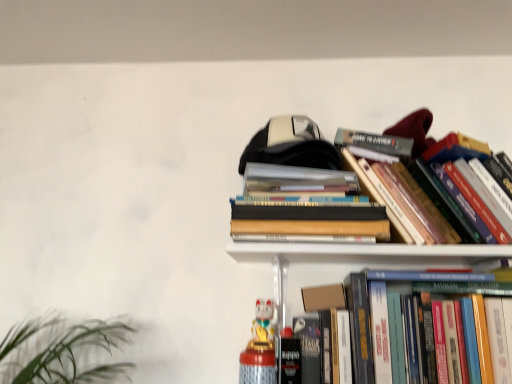
The image size is (512, 384). What do you see at coordinates (323, 297) in the screenshot? I see `cardboard box at upper center` at bounding box center [323, 297].

In order to face hardcover books at upper center, which is counted as the 2th book, starting from the top, should I rotate leftwards or rightwards?

Turn right by 7.086 degrees to look at hardcover books at upper center, which is counted as the 2th book, starting from the top.

Where is `cardboard box at upper center`? The width and height of the screenshot is (512, 384). cardboard box at upper center is located at coordinates (323, 297).

Between cardboard box at upper center and hardcover book at center right, positioned as the 1th book in bottom-to-top order, which one has smaller width?

cardboard box at upper center.

Does cardboard box at upper center touch hardcover book at center right, the third book in the top-to-bottom sequence?

No.

From the image's perspective, would you say cardboard box at upper center is positioned over hardcover book at center right, positioned as the 1th book in bottom-to-top order?

Yes, from the image's perspective, cardboard box at upper center is on top of hardcover book at center right, positioned as the 1th book in bottom-to-top order.

Does cardboard box at upper center have a lesser height compared to white glossy cat figurine at lower center?

Yes, cardboard box at upper center is shorter than white glossy cat figurine at lower center.

From the image's perspective, which is above, cardboard box at upper center or white glossy cat figurine at lower center?

From the image's view, cardboard box at upper center is above.

Is cardboard box at upper center facing towards white glossy cat figurine at lower center?

No, cardboard box at upper center is not aimed at white glossy cat figurine at lower center.

In terms of width, does cardboard box at upper center look wider or thinner when compared to white glossy cat figurine at lower center?

cardboard box at upper center is thinner than white glossy cat figurine at lower center.

Is hardcover book at center right, the third book in the top-to-bottom sequence, facing away from cardboard box at upper center?

Absolutely, hardcover book at center right, the third book in the top-to-bottom sequence, is directed away from cardboard box at upper center.

Looking at this image, from the image's perspective, which one is positioned lower, hardcover book at center right, the third book in the top-to-bottom sequence, or cardboard box at upper center?

hardcover book at center right, the third book in the top-to-bottom sequence, from the image's perspective.

From a real-world perspective, is hardcover book at center right, the third book in the top-to-bottom sequence, above or below cardboard box at upper center?

hardcover book at center right, the third book in the top-to-bottom sequence, is situated lower than cardboard box at upper center in the real world.

Considering the sizes of objects hardcover book at center right, the third book in the top-to-bottom sequence, and cardboard box at upper center in the image provided, who is shorter, hardcover book at center right, the third book in the top-to-bottom sequence, or cardboard box at upper center?

cardboard box at upper center is shorter.

From the image's perspective, is hardcover books at upper right, the third book when ordered from bottom to top, beneath hardcover book at center right, the third book in the top-to-bottom sequence?

Actually, hardcover books at upper right, the third book when ordered from bottom to top, appears above hardcover book at center right, the third book in the top-to-bottom sequence, in the image.

Measure the distance between hardcover books at upper right, the third book when ordered from bottom to top, and hardcover book at center right, positioned as the 1th book in bottom-to-top order.

hardcover books at upper right, the third book when ordered from bottom to top, and hardcover book at center right, positioned as the 1th book in bottom-to-top order, are 7.07 inches apart from each other.

Is hardcover books at upper right, the third book when ordered from bottom to top, bigger than hardcover book at center right, the third book in the top-to-bottom sequence?

Incorrect, hardcover books at upper right, the third book when ordered from bottom to top, is not larger than hardcover book at center right, the third book in the top-to-bottom sequence.

Is hardcover book at center right, the third book in the top-to-bottom sequence, at the back of hardcover books at upper right, which appears as the 1th book when viewed from the top?

No, hardcover books at upper right, which appears as the 1th book when viewed from the top, is not facing away from hardcover book at center right, the third book in the top-to-bottom sequence.

In the scene shown: Does hardcover book at center right, positioned as the 1th book in bottom-to-top order, have a greater height compared to white glossy cat figurine at lower center?

Correct, hardcover book at center right, positioned as the 1th book in bottom-to-top order, is much taller as white glossy cat figurine at lower center.

Which object is positioned more to the right, hardcover book at center right, positioned as the 1th book in bottom-to-top order, or white glossy cat figurine at lower center?

hardcover book at center right, positioned as the 1th book in bottom-to-top order.

Locate an element on the screen. This screenshot has width=512, height=384. the 3rd book in front of the white glossy cat figurine at lower center, starting your count from the anchor is located at coordinates (366, 324).

Considering the relative sizes of hardcover book at center right, positioned as the 1th book in bottom-to-top order, and white glossy cat figurine at lower center in the image provided, is hardcover book at center right, positioned as the 1th book in bottom-to-top order, smaller than white glossy cat figurine at lower center?

No.

Is hardcover books at upper center, which ranks as the 2th book in bottom-to-top order, far away from cardboard box at upper center?

hardcover books at upper center, which ranks as the 2th book in bottom-to-top order, is actually quite close to cardboard box at upper center.

Could you measure the distance between hardcover books at upper center, which ranks as the 2th book in bottom-to-top order, and cardboard box at upper center?

hardcover books at upper center, which ranks as the 2th book in bottom-to-top order, is 8.29 inches from cardboard box at upper center.

There is a cardboard box at upper center. Where is `the 1st book above it (from the image's perspective)`? This screenshot has width=512, height=384. the 1st book above it (from the image's perspective) is located at coordinates (309, 219).

Considering the sizes of objects hardcover books at upper center, which is counted as the 2th book, starting from the top, and cardboard box at upper center in the image provided, who is wider, hardcover books at upper center, which is counted as the 2th book, starting from the top, or cardboard box at upper center?

Wider between the two is hardcover books at upper center, which is counted as the 2th book, starting from the top.

Considering the positions of objects hardcover books at upper center, which ranks as the 2th book in bottom-to-top order, and white glossy cat figurine at lower center in the image provided, who is behind, hardcover books at upper center, which ranks as the 2th book in bottom-to-top order, or white glossy cat figurine at lower center?

Positioned behind is white glossy cat figurine at lower center.

Is hardcover books at upper center, which is counted as the 2th book, starting from the top, located outside white glossy cat figurine at lower center?

Absolutely, hardcover books at upper center, which is counted as the 2th book, starting from the top, is external to white glossy cat figurine at lower center.

Does point (266, 223) lie behind point (252, 324)?

No, (266, 223) is closer to viewer.

You are a GUI agent. You are given a task and a screenshot of the screen. Output one action in this format:
    pyautogui.click(x=<x>, y=<y>)
    Task: Click on the toy on the left of the hardcover books at upper center, which is counted as the 2th book, starting from the top
    
    Given the screenshot: What is the action you would take?
    pyautogui.click(x=260, y=347)

The image size is (512, 384). I want to click on paperback book located above the hardcover book at center right, the third book in the top-to-bottom sequence (from a real-world perspective), so click(x=323, y=297).

Where is `paperback book lying on the right of white glossy cat figurine at lower center`? Image resolution: width=512 pixels, height=384 pixels. paperback book lying on the right of white glossy cat figurine at lower center is located at coordinates (323, 297).

From the image, which object appears to be farther from white glossy cat figurine at lower center, hardcover books at upper center, which is counted as the 2th book, starting from the top, or hardcover book at center right, positioned as the 1th book in bottom-to-top order?

hardcover books at upper center, which is counted as the 2th book, starting from the top, is positioned further to the anchor white glossy cat figurine at lower center.

Estimate the real-world distances between objects in this image. Which object is closer to white glossy cat figurine at lower center, hardcover books at upper right, the third book when ordered from bottom to top, or hardcover book at center right, the third book in the top-to-bottom sequence?

hardcover book at center right, the third book in the top-to-bottom sequence, lies closer to white glossy cat figurine at lower center than the other object.

When comparing their distances from hardcover books at upper right, the third book when ordered from bottom to top, does hardcover book at center right, the third book in the top-to-bottom sequence, or cardboard box at upper center seem further?

Among the two, cardboard box at upper center is located further to hardcover books at upper right, the third book when ordered from bottom to top.

Based on their spatial positions, is hardcover book at center right, positioned as the 1th book in bottom-to-top order, or hardcover books at upper center, which ranks as the 2th book in bottom-to-top order, further from white glossy cat figurine at lower center?

hardcover books at upper center, which ranks as the 2th book in bottom-to-top order.

Which object lies further to the anchor point white glossy cat figurine at lower center, hardcover book at center right, the third book in the top-to-bottom sequence, or cardboard box at upper center?

hardcover book at center right, the third book in the top-to-bottom sequence, is further to white glossy cat figurine at lower center.

When comparing their distances from hardcover books at upper right, the third book when ordered from bottom to top, does hardcover books at upper center, which ranks as the 2th book in bottom-to-top order, or hardcover book at center right, the third book in the top-to-bottom sequence, seem closer?

The object closer to hardcover books at upper right, the third book when ordered from bottom to top, is hardcover books at upper center, which ranks as the 2th book in bottom-to-top order.

Looking at the image, which one is located closer to cardboard box at upper center, hardcover books at upper center, which is counted as the 2th book, starting from the top, or hardcover book at center right, the third book in the top-to-bottom sequence?

hardcover book at center right, the third book in the top-to-bottom sequence, is positioned closer to the anchor cardboard box at upper center.

Based on their spatial positions, is hardcover books at upper right, the third book when ordered from bottom to top, or hardcover books at upper center, which is counted as the 2th book, starting from the top, closer to hardcover book at center right, positioned as the 1th book in bottom-to-top order?

hardcover books at upper right, the third book when ordered from bottom to top, is positioned closer to the anchor hardcover book at center right, positioned as the 1th book in bottom-to-top order.

At what (x,y) coordinates should I click in order to perform the action: click on paperback book between hardcover books at upper center, which is counted as the 2th book, starting from the top, and white glossy cat figurine at lower center vertically. Please return your answer as a coordinate pair (x, y). Looking at the image, I should click on (323, 297).

You are a GUI agent. You are given a task and a screenshot of the screen. Output one action in this format:
    pyautogui.click(x=<x>, y=<y>)
    Task: Click on the paperback book between hardcover books at upper center, which is counted as the 2th book, starting from the top, and hardcover book at center right, the third book in the top-to-bottom sequence, vertically
    The width and height of the screenshot is (512, 384).
    Given the screenshot: What is the action you would take?
    pyautogui.click(x=323, y=297)

At what (x,y) coordinates should I click in order to perform the action: click on paperback book between hardcover books at upper right, which appears as the 1th book when viewed from the top, and hardcover book at center right, positioned as the 1th book in bottom-to-top order, in the vertical direction. Please return your answer as a coordinate pair (x, y). The width and height of the screenshot is (512, 384). Looking at the image, I should click on (323, 297).

Where is `paperback book between white glossy cat figurine at lower center and hardcover book at center right, positioned as the 1th book in bottom-to-top order`? The width and height of the screenshot is (512, 384). paperback book between white glossy cat figurine at lower center and hardcover book at center right, positioned as the 1th book in bottom-to-top order is located at coordinates (323, 297).